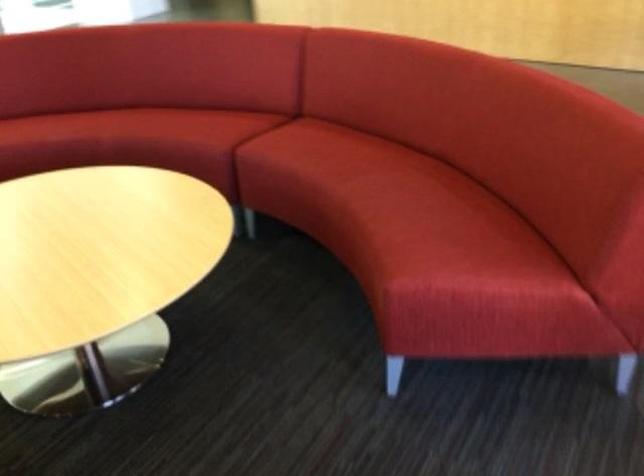
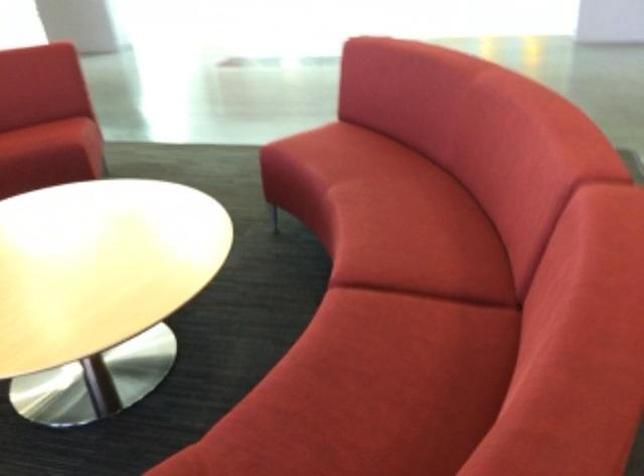
In the second image, find the point that corresponds to [219,122] in the first image.

(418, 239)